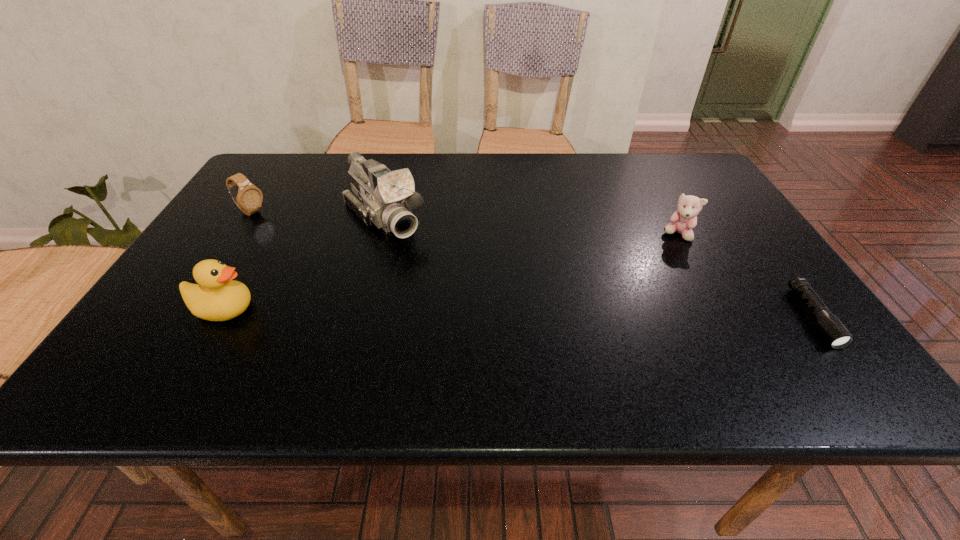
Locate an element on the screen. Image resolution: width=960 pixels, height=540 pixels. object identified as the closest to the watch is located at coordinates (385, 198).

This screenshot has width=960, height=540. I want to click on object identified as the third closest to the watch, so click(x=683, y=220).

You are a GUI agent. You are given a task and a screenshot of the screen. Output one action in this format:
    pyautogui.click(x=<x>, y=<y>)
    Task: Click on the free location that satisfies the following two spatial constraints: 1. on the front side of the third object from left to right; 2. on the left side of the second object from right to left
    This screenshot has width=960, height=540.
    Given the screenshot: What is the action you would take?
    pyautogui.click(x=379, y=234)